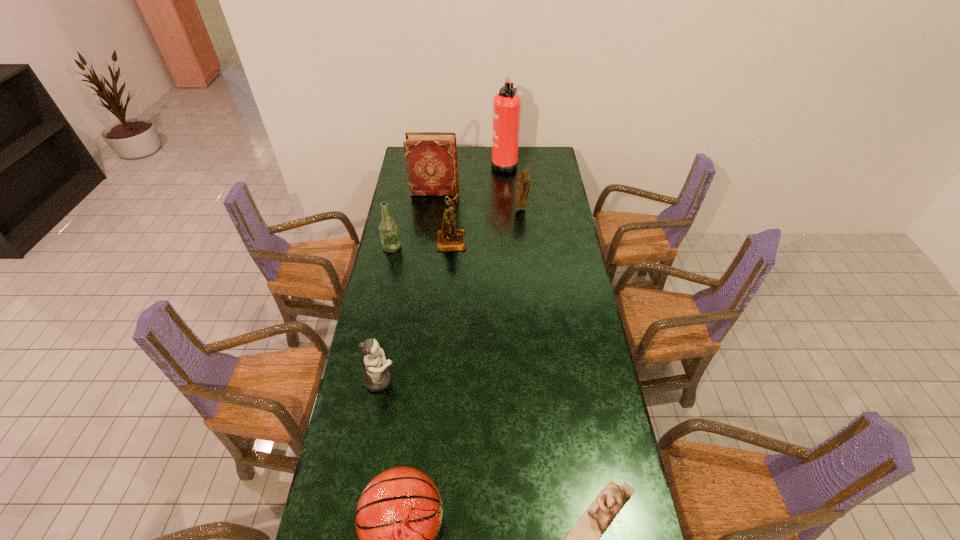
Locate an element on the screen. Image resolution: width=960 pixels, height=540 pixels. figurine positioned at the left edge is located at coordinates (377, 377).

The height and width of the screenshot is (540, 960). In order to click on vacant area at the far edge in this screenshot , I will do `click(486, 147)`.

In the image, there is a desktop. Identify the location of vacant area at the left edge. This screenshot has width=960, height=540. (362, 396).

In the image, there is a desktop. Where is `vacant space at the right edge`? vacant space at the right edge is located at coordinates click(x=578, y=345).

The height and width of the screenshot is (540, 960). Identify the location of free location at the far right corner. (547, 152).

The width and height of the screenshot is (960, 540). Identify the location of free spot between the fire extinguisher and the third nearest object. (442, 272).

The image size is (960, 540). In order to click on free space between the beer bottle and the second nearest figurine in this screenshot , I will do `click(386, 313)`.

Image resolution: width=960 pixels, height=540 pixels. In order to click on free space between the beer bottle and the third nearest figurine in this screenshot , I will do `click(421, 244)`.

Identify the location of free spot between the third nearest figurine and the farthest object. The image size is (960, 540). (478, 202).

The width and height of the screenshot is (960, 540). I want to click on free space between the second farthest object and the tallest object, so click(469, 178).